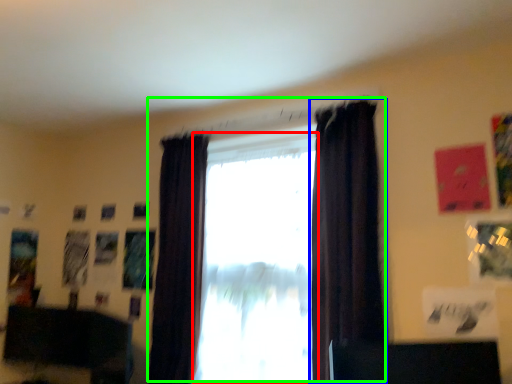
Question: Considering the real-world distances, which object is closest to window (highlighted by a red box)? curtain (highlighted by a blue box) or window (highlighted by a green box).

Choices:
 (A) curtain
 (B) window

Answer: (B)